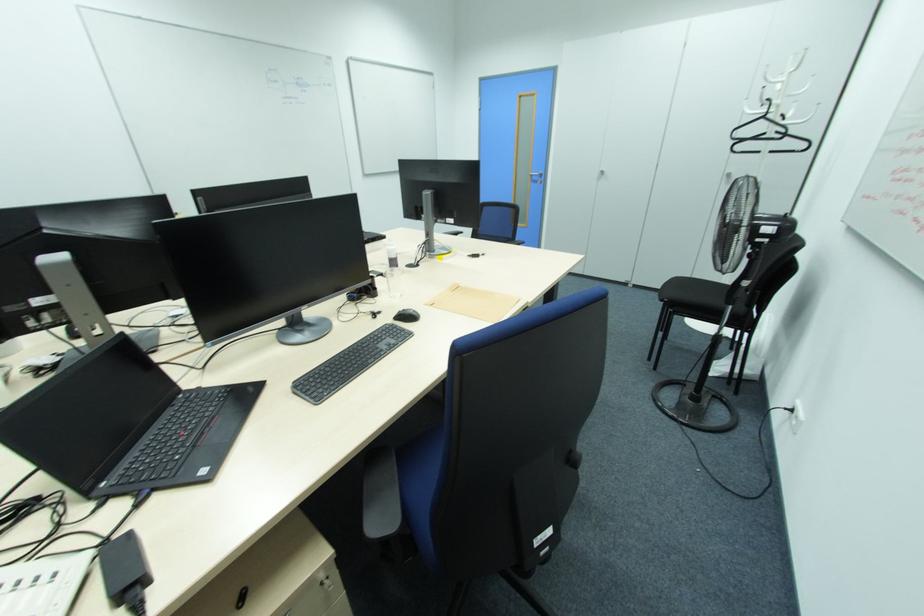
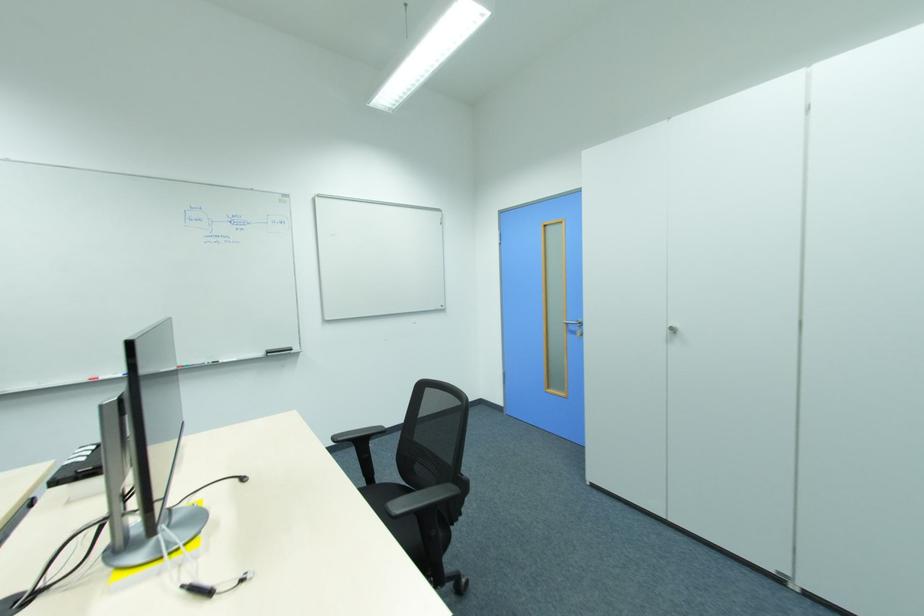
The images are taken continuously from a first-person perspective. In which direction are you moving?

The cameraman walked toward right, forward.